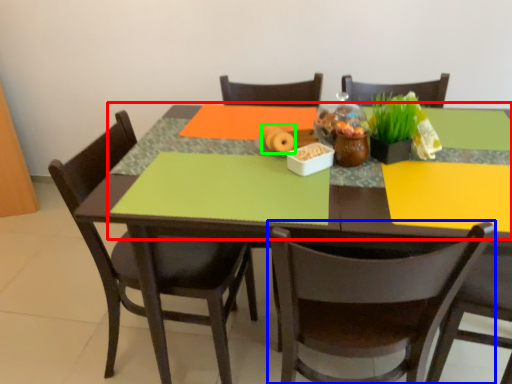
Question: Which object is positioned closest to tablecloth (highlighted by a red box)? Select from chair (highlighted by a blue box) and food (highlighted by a green box).

Choices:
 (A) chair
 (B) food

Answer: (A)